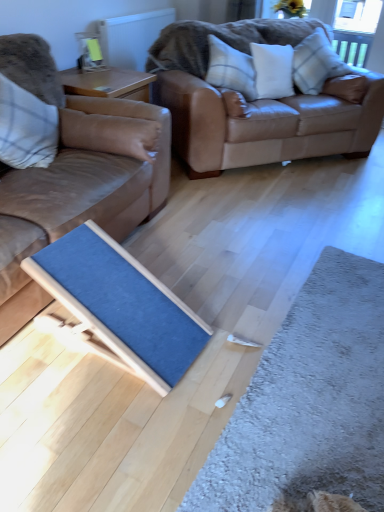
Where is `vacant space in front of brown leather couch at upper center, placed as the 1th studio couch when sorted from right to left`? vacant space in front of brown leather couch at upper center, placed as the 1th studio couch when sorted from right to left is located at coordinates (270, 216).